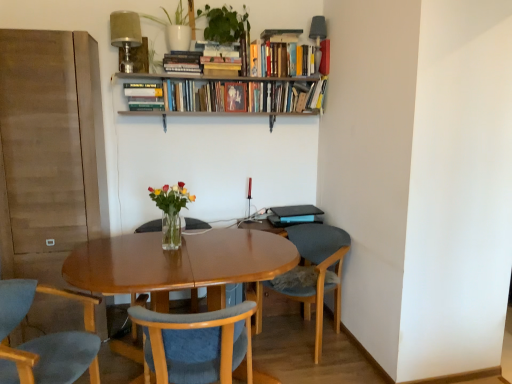
Question: Is blue fabric chair at lower left, the third chair positioned from the right, surrounding translucent glass vase at center?

Choices:
 (A) yes
 (B) no

Answer: (B)

Question: Considering the relative positions of blue fabric chair at lower left, the third chair positioned from the right, and translucent glass vase at center in the image provided, is blue fabric chair at lower left, the third chair positioned from the right, to the left of translucent glass vase at center from the viewer's perspective?

Choices:
 (A) yes
 (B) no

Answer: (A)

Question: Considering the relative sizes of blue fabric chair at lower left, the third chair positioned from the right, and translucent glass vase at center in the image provided, is blue fabric chair at lower left, the third chair positioned from the right, smaller than translucent glass vase at center?

Choices:
 (A) no
 (B) yes

Answer: (A)

Question: Is blue fabric chair at lower left, acting as the first chair starting from the left, not close to translucent glass vase at center?

Choices:
 (A) yes
 (B) no

Answer: (B)

Question: Are blue fabric chair at lower left, acting as the first chair starting from the left, and translucent glass vase at center beside each other?

Choices:
 (A) no
 (B) yes

Answer: (A)

Question: Is hardcover books at upper center, which is counted as the fourth book, starting from the left, in front of or behind hardcover book at upper center, the first book viewed from the left, in the image?

Choices:
 (A) behind
 (B) front

Answer: (A)

Question: Looking at their shapes, would you say hardcover books at upper center, which is counted as the fourth book, starting from the left, is wider or thinner than hardcover book at upper center, the first book viewed from the left?

Choices:
 (A) thin
 (B) wide

Answer: (A)

Question: Considering the relative positions of hardcover books at upper center, the 3th book in the right-to-left sequence, and hardcover book at upper center, which is the 6th book in right-to-left order, in the image provided, is hardcover books at upper center, the 3th book in the right-to-left sequence, to the left or to the right of hardcover book at upper center, which is the 6th book in right-to-left order,?

Choices:
 (A) right
 (B) left

Answer: (A)

Question: Is hardcover books at upper center, which is counted as the fourth book, starting from the left, bigger or smaller than hardcover book at upper center, the first book viewed from the left?

Choices:
 (A) big
 (B) small

Answer: (A)

Question: In terms of width, does blue fabric chair at lower right, which is the 1th chair in right-to-left order, look wider or thinner when compared to green matte plant at upper center?

Choices:
 (A) thin
 (B) wide

Answer: (B)

Question: Does point click(x=307, y=226) appear closer or farther from the camera than point click(x=217, y=33)?

Choices:
 (A) farther
 (B) closer

Answer: (A)

Question: Considering the positions of blue fabric chair at lower right, which is the 1th chair in right-to-left order, and green matte plant at upper center in the image, is blue fabric chair at lower right, which is the 1th chair in right-to-left order, bigger or smaller than green matte plant at upper center?

Choices:
 (A) small
 (B) big

Answer: (B)

Question: In the image, is blue fabric chair at lower right, the 3th chair when ordered from left to right, on the left side or the right side of green matte plant at upper center?

Choices:
 (A) right
 (B) left

Answer: (A)

Question: Looking at the image, does hardcover books at upper center, acting as the 5th book starting from the left, seem bigger or smaller compared to hardcover book at upper center, marked as the 1th book in a right-to-left arrangement?

Choices:
 (A) big
 (B) small

Answer: (A)

Question: From a real-world perspective, relative to hardcover book at upper center, the sixth book from the left, is hardcover books at upper center, which is the 2th book in right-to-left order, vertically above or below?

Choices:
 (A) below
 (B) above

Answer: (A)